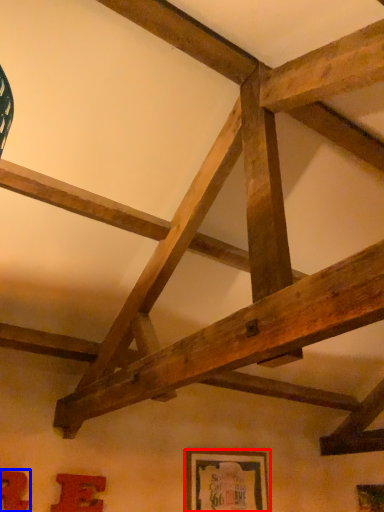
Question: Which point is closer to the camera, picture frame (highlighted by a red box) or picture frame (highlighted by a blue box)?

Choices:
 (A) picture frame
 (B) picture frame

Answer: (B)